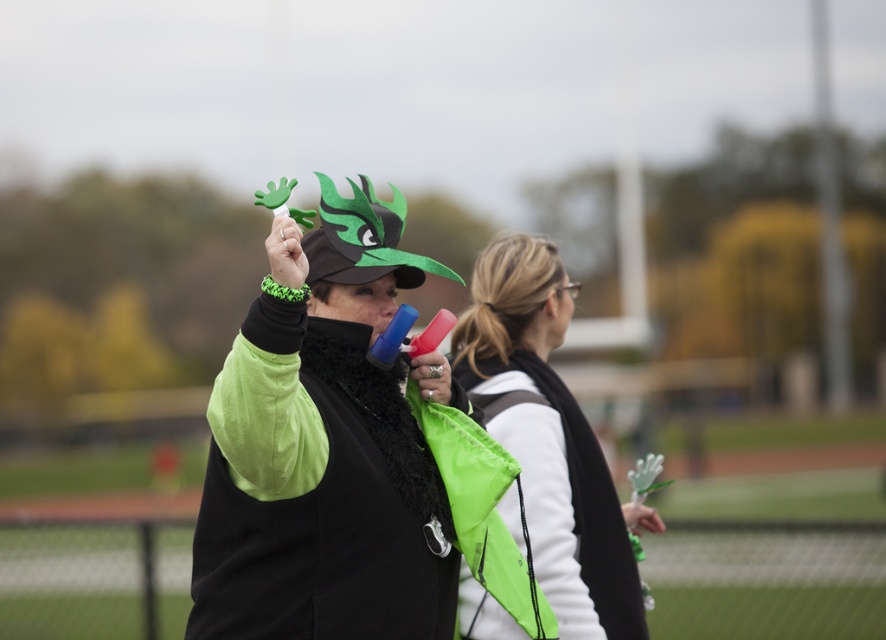
You are an event organizer planning to display a mascot costume from the sports event in a showcase. The costume includes both the matte green plastic hand at center and the neon green jacket at center. If you want to arrange them side by side, which object should be placed first to ensure proper scaling?

The matte green plastic hand at center should be placed first since it is smaller in size compared to the neon green jacket at center, allowing for a balanced arrangement based on scale.

You are a photographer trying to capture the best shot of the green plastic hand at center. You notice a point marked at coordinates (327, 464). Where is this point located?

The point at (327, 464) is located on the matte green plastic hand at center.

You are a photographer trying to capture a closeup of the person in the foreground while also including the track and field area in the background. Which of the two points, point (x=354, y=310) or point (x=556, y=618), is closer to the camera?

Point (x=354, y=310) is closer to the camera than point (x=556, y=618).